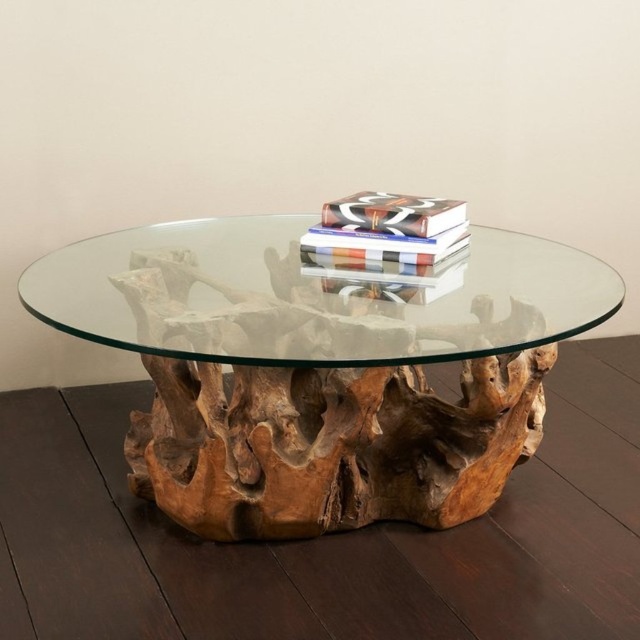
Question: Which of the following is the farthest from the observer?

Choices:
 (A) natural wood root table at center
 (B) transparent glass table at center

Answer: (B)

Question: From the image, what is the correct spatial relationship of transparent glass table at center in relation to matte black book at center?

Choices:
 (A) above
 (B) below

Answer: (B)

Question: Does transparent glass table at center have a larger size compared to multicolored paper book at center?

Choices:
 (A) no
 (B) yes

Answer: (B)

Question: Estimate the real-world distances between objects in this image. Which object is farther from the natural wood root table at center?

Choices:
 (A) multicolored paper book at center
 (B) brown wood tree trunk at center
 (C) matte black book at center
 (D) transparent glass table at center

Answer: (B)

Question: Does transparent glass table at center come in front of matte black book at center?

Choices:
 (A) yes
 (B) no

Answer: (A)

Question: Which is nearer to the matte black book at center?

Choices:
 (A) transparent glass table at center
 (B) multicolored paper book at center

Answer: (B)